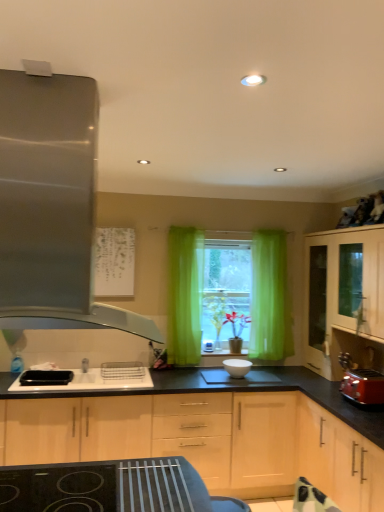
Describe the element at coordinates (363, 386) in the screenshot. The image size is (384, 512). I see `matte red toaster at right` at that location.

This screenshot has height=512, width=384. Describe the element at coordinates (114, 262) in the screenshot. I see `white paper at upper center` at that location.

The width and height of the screenshot is (384, 512). Describe the element at coordinates (91, 382) in the screenshot. I see `black plastic sink at center` at that location.

Measure the distance between point (x=203, y=277) and camera.

Point (x=203, y=277) is 3.83 meters from camera.

At what (x,y) coordinates should I click in order to perform the action: click on white glossy bowl at center. Please return your answer as a coordinate pair (x, y). The image size is (384, 512). Looking at the image, I should click on (237, 367).

The width and height of the screenshot is (384, 512). What do you see at coordinates (237, 367) in the screenshot?
I see `white glossy bowl at center` at bounding box center [237, 367].

What do you see at coordinates (212, 433) in the screenshot? I see `light wood cabinet at center, positioned as the 3th cabinetry in right-to-left order` at bounding box center [212, 433].

This screenshot has width=384, height=512. I want to click on matte red toaster at right, so click(x=363, y=386).

From the image's perspective, between light wood cabinet at lower right, the 2th cabinetry viewed from the right, and matte red toaster at right, which one is located above?

matte red toaster at right.

This screenshot has height=512, width=384. Identify the location of toaster that is above the light wood cabinet at lower right, the 2th cabinetry viewed from the right (from a real-world perspective). (363, 386).

Which is more to the left, light wood cabinet at lower right, the 2th cabinetry viewed from the right, or matte red toaster at right?

matte red toaster at right.

Is matte red toaster at right not near green sheer curtain at center?

Yes, matte red toaster at right is far from green sheer curtain at center.

Considering the sizes of objects matte red toaster at right and green sheer curtain at center in the image provided, who is smaller, matte red toaster at right or green sheer curtain at center?

matte red toaster at right is smaller.

Which is more to the right, matte red toaster at right or green sheer curtain at center?

matte red toaster at right is more to the right.

Which object is further away from the camera, light wood cabinet at lower right, the 2th cabinetry viewed from the right, or white paper at upper center?

white paper at upper center is further away from the camera.

From a real-world perspective, is light wood cabinet at lower right, the 2th cabinetry viewed from the right, physically located above or below white paper at upper center?

In terms of real-world spatial position, light wood cabinet at lower right, the 2th cabinetry viewed from the right, is below white paper at upper center.

In terms of width, does light wood cabinet at lower right, the 2th cabinetry viewed from the left, look wider or thinner when compared to white paper at upper center?

Clearly, light wood cabinet at lower right, the 2th cabinetry viewed from the left, has more width compared to white paper at upper center.

Is green sheer curtain at center wider or thinner than light wood cabinet at right, which ranks as the 3th cabinetry in left-to-right order?

In the image, green sheer curtain at center appears to be more narrow than light wood cabinet at right, which ranks as the 3th cabinetry in left-to-right order.

From a real-world perspective, is green sheer curtain at center positioned over light wood cabinet at right, which ranks as the 3th cabinetry in left-to-right order, based on gravity?

Yes, from a real-world perspective, green sheer curtain at center is above light wood cabinet at right, which ranks as the 3th cabinetry in left-to-right order.

Considering the sizes of objects green sheer curtain at center and light wood cabinet at right, the 1th cabinetry when ordered from right to left, in the image provided, who is shorter, green sheer curtain at center or light wood cabinet at right, the 1th cabinetry when ordered from right to left,?

With less height is light wood cabinet at right, the 1th cabinetry when ordered from right to left.

From the image's perspective, who appears lower, green sheer curtain at center or light wood cabinet at right, which ranks as the 3th cabinetry in left-to-right order?

From the image's view, light wood cabinet at right, which ranks as the 3th cabinetry in left-to-right order, is below.

Which is closer to the camera, (249,362) or (39,86)?

Point (249,362).

Which of these two, white glossy bowl at center or satin metallic range hood at left, is thinner?

white glossy bowl at center is thinner.

From the image's perspective, would you say white glossy bowl at center is positioned over satin metallic range hood at left?

Incorrect, from the image's perspective, white glossy bowl at center is lower than satin metallic range hood at left.

Is white glossy bowl at center positioned with its back to satin metallic range hood at left?

white glossy bowl at center does not have its back to satin metallic range hood at left.

Is light wood cabinet at center, acting as the 1th cabinetry starting from the left, in front of or behind light wood cabinet at lower right, the 2th cabinetry viewed from the left, in the image?

Clearly, light wood cabinet at center, acting as the 1th cabinetry starting from the left, is behind light wood cabinet at lower right, the 2th cabinetry viewed from the left.

From the image's perspective, between light wood cabinet at center, acting as the 1th cabinetry starting from the left, and light wood cabinet at lower right, the 2th cabinetry viewed from the left, who is located below?

light wood cabinet at lower right, the 2th cabinetry viewed from the left, is shown below in the image.

Looking at the image, does light wood cabinet at center, positioned as the 3th cabinetry in right-to-left order, seem bigger or smaller compared to light wood cabinet at lower right, the 2th cabinetry viewed from the left?

light wood cabinet at center, positioned as the 3th cabinetry in right-to-left order, is bigger than light wood cabinet at lower right, the 2th cabinetry viewed from the left.

Considering the sizes of light wood cabinet at center, positioned as the 3th cabinetry in right-to-left order, and light wood cabinet at lower right, the 2th cabinetry viewed from the left, in the image, is light wood cabinet at center, positioned as the 3th cabinetry in right-to-left order, wider or thinner than light wood cabinet at lower right, the 2th cabinetry viewed from the left,?

Clearly, light wood cabinet at center, positioned as the 3th cabinetry in right-to-left order, has less width compared to light wood cabinet at lower right, the 2th cabinetry viewed from the left.

Can you confirm if light wood cabinet at lower right, the 2th cabinetry viewed from the left, is thinner than light wood cabinet at center, positioned as the 3th cabinetry in right-to-left order?

In fact, light wood cabinet at lower right, the 2th cabinetry viewed from the left, might be wider than light wood cabinet at center, positioned as the 3th cabinetry in right-to-left order.

From the image's perspective, which is below, light wood cabinet at lower right, the 2th cabinetry viewed from the left, or light wood cabinet at center, positioned as the 3th cabinetry in right-to-left order?

light wood cabinet at lower right, the 2th cabinetry viewed from the left, is shown below in the image.

How many degrees apart are the facing directions of light wood cabinet at lower right, the 2th cabinetry viewed from the left, and light wood cabinet at center, acting as the 1th cabinetry starting from the left?

light wood cabinet at lower right, the 2th cabinetry viewed from the left, and light wood cabinet at center, acting as the 1th cabinetry starting from the left, are facing 90.3 degrees away from each other.

Would you say light wood cabinet at lower right, the 2th cabinetry viewed from the left, is a long distance from light wood cabinet at center, positioned as the 3th cabinetry in right-to-left order?

No, light wood cabinet at lower right, the 2th cabinetry viewed from the left, is not far away from light wood cabinet at center, positioned as the 3th cabinetry in right-to-left order.

At what (x,y) coordinates should I click in order to perform the action: click on toaster behind the light wood cabinet at lower right, the 2th cabinetry viewed from the right. Please return your answer as a coordinate pair (x, y). The width and height of the screenshot is (384, 512). Looking at the image, I should click on (363, 386).

The width and height of the screenshot is (384, 512). I want to click on curtain above the matte red toaster at right (from a real-world perspective), so click(x=185, y=295).

From the image, which object appears to be farther from black plastic sink at center, white paper at upper center or green sheer curtain at center?

white paper at upper center is further to black plastic sink at center.

Which object lies further to the anchor point white paper at upper center, light wood cabinet at lower right, the 2th cabinetry viewed from the left, or matte red toaster at right?

Among the two, matte red toaster at right is located further to white paper at upper center.

Which object lies further to the anchor point light wood cabinet at right, which ranks as the 3th cabinetry in left-to-right order, light wood cabinet at lower right, the 2th cabinetry viewed from the left, or black plastic sink at center?

black plastic sink at center is further to light wood cabinet at right, which ranks as the 3th cabinetry in left-to-right order.

From the image, which object appears to be farther from black plastic sink at center, matte red toaster at right or satin metallic range hood at left?

satin metallic range hood at left is further to black plastic sink at center.

Which object lies nearer to the anchor point white paper at upper center, green sheer curtain at center or white glossy bowl at center?

green sheer curtain at center.

Looking at the image, which one is located further to white glossy bowl at center, light wood cabinet at center, positioned as the 3th cabinetry in right-to-left order, or satin metallic range hood at left?

Among the two, satin metallic range hood at left is located further to white glossy bowl at center.

Considering their positions, is light wood cabinet at lower right, the 2th cabinetry viewed from the left, positioned closer to black plastic sink at center than matte red toaster at right?

Among the two, light wood cabinet at lower right, the 2th cabinetry viewed from the left, is located nearer to black plastic sink at center.

Considering their positions, is black plastic sink at center positioned closer to green sheer curtain at center than white paper at upper center?

The object closer to green sheer curtain at center is white paper at upper center.

Where is `cabinetry between satin metallic range hood at left and matte red toaster at right`? cabinetry between satin metallic range hood at left and matte red toaster at right is located at coordinates pos(212,433).

The width and height of the screenshot is (384, 512). I want to click on sink between green sheer curtain at center and light wood cabinet at center, positioned as the 3th cabinetry in right-to-left order, from top to bottom, so click(91, 382).

Where is `toaster between light wood cabinet at center, acting as the 1th cabinetry starting from the left, and light wood cabinet at lower right, the 2th cabinetry viewed from the right`? This screenshot has height=512, width=384. toaster between light wood cabinet at center, acting as the 1th cabinetry starting from the left, and light wood cabinet at lower right, the 2th cabinetry viewed from the right is located at coordinates (363, 386).

Locate an element on the screen. This screenshot has width=384, height=512. appliance between light wood cabinet at center, positioned as the 3th cabinetry in right-to-left order, and matte red toaster at right, in the horizontal direction is located at coordinates (237, 367).